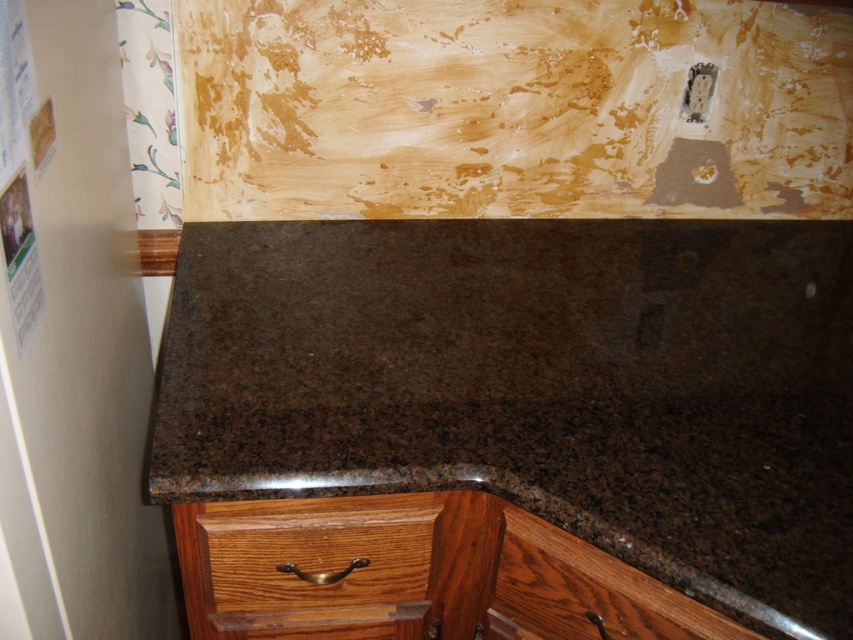
Consider the image. You are trying to clean the brown granite countertop at center and the brown wood drawer at lower center. Which one is closer to you?

The brown granite countertop at center is closer to you since it is in front of the brown wood drawer at lower center.

You are standing in the kitchen and want to place a 24 inch tall vase on the brown granite countertop at center. Can you fit it without it overhanging the edge?

The brown granite countertop at center is 23.45 inches away from the camera, so the 24 inch tall vase would be slightly taller than the distance to the countertop. However, since the question is about fitting the vase on the countertop without overhanging, the height of the vase is not directly related to the distance from the camera. The answer should focus on the countertop dimensions. Since the description does not provide the countertop length or width, we cannot determine if the vase will overhang. The